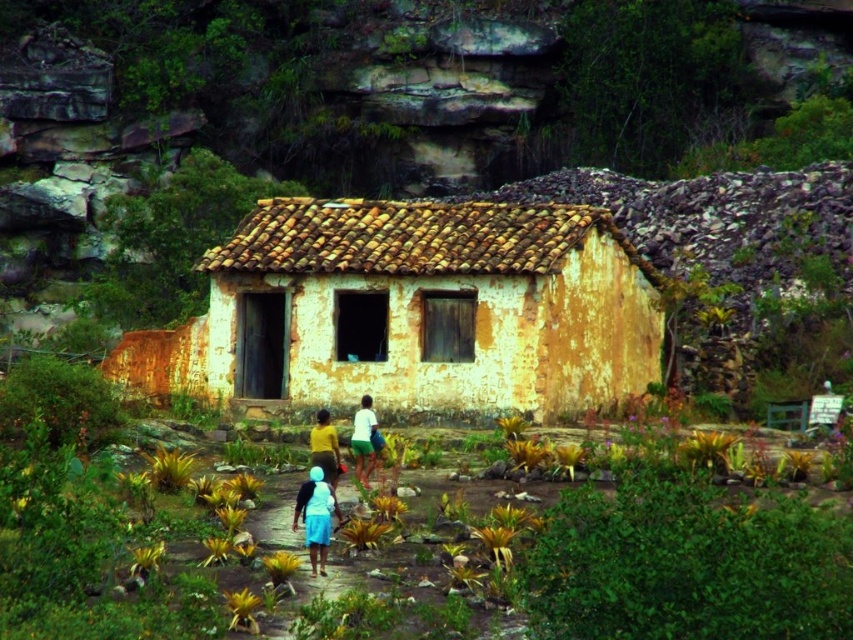
Question: Which of the following is the farthest from the observer?

Choices:
 (A) (508, 310)
 (B) (364, 452)
 (C) (312, 464)

Answer: (A)

Question: Does yellow matte shirt at center have a larger size compared to white matte shirt at center?

Choices:
 (A) no
 (B) yes

Answer: (A)

Question: Which point is closer to the camera taking this photo?

Choices:
 (A) (328, 532)
 (B) (334, 445)
 (C) (358, 472)

Answer: (A)

Question: Is yellowish weathered wood hut at center further to the viewer compared to white matte shirt at center?

Choices:
 (A) yes
 (B) no

Answer: (A)

Question: Which point is closer to the camera taking this photo?

Choices:
 (A) (354, 451)
 (B) (325, 424)

Answer: (B)

Question: Is yellow matte shirt at center thinner than white matte shirt at center?

Choices:
 (A) no
 (B) yes

Answer: (B)